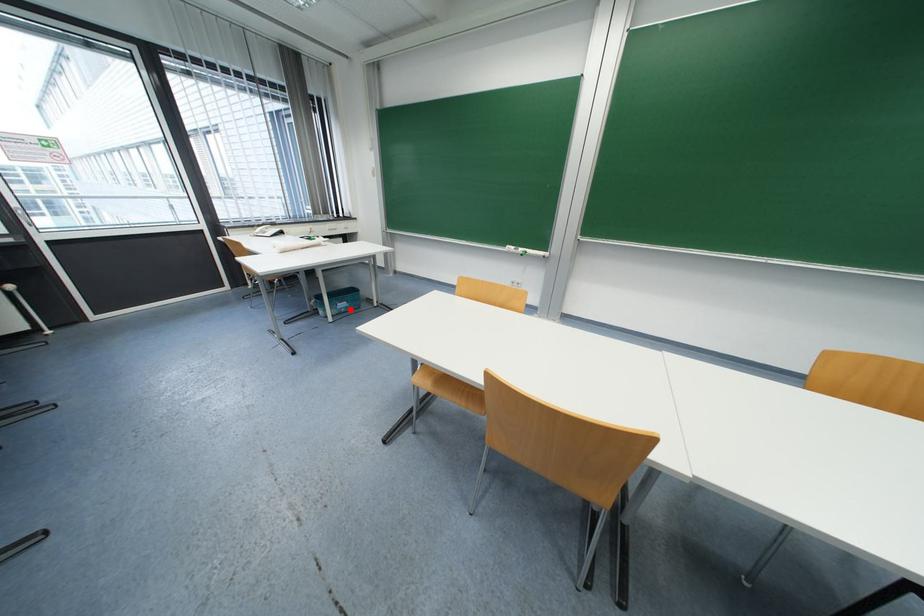
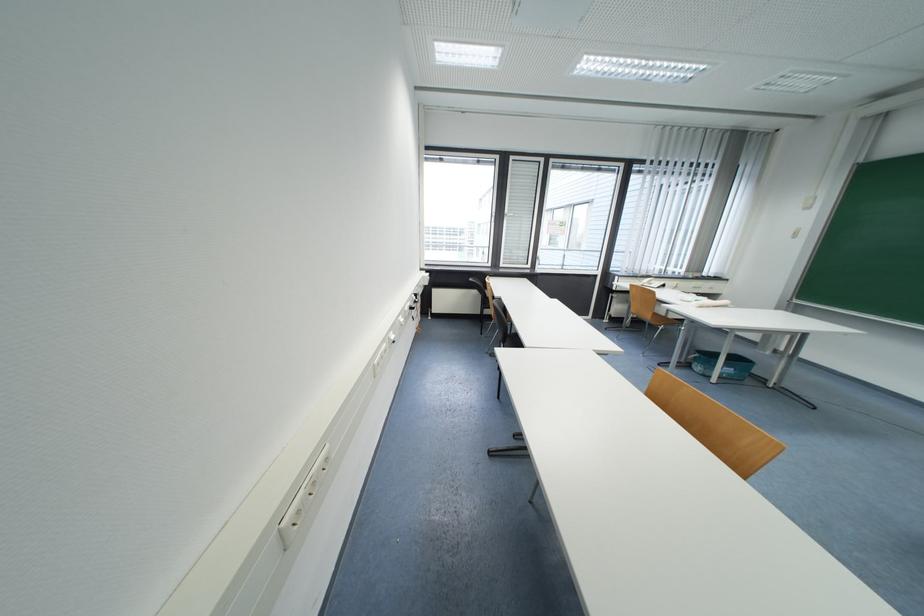
Where in the second image is the point corresponding to the highlighted location from the first image?

(734, 377)